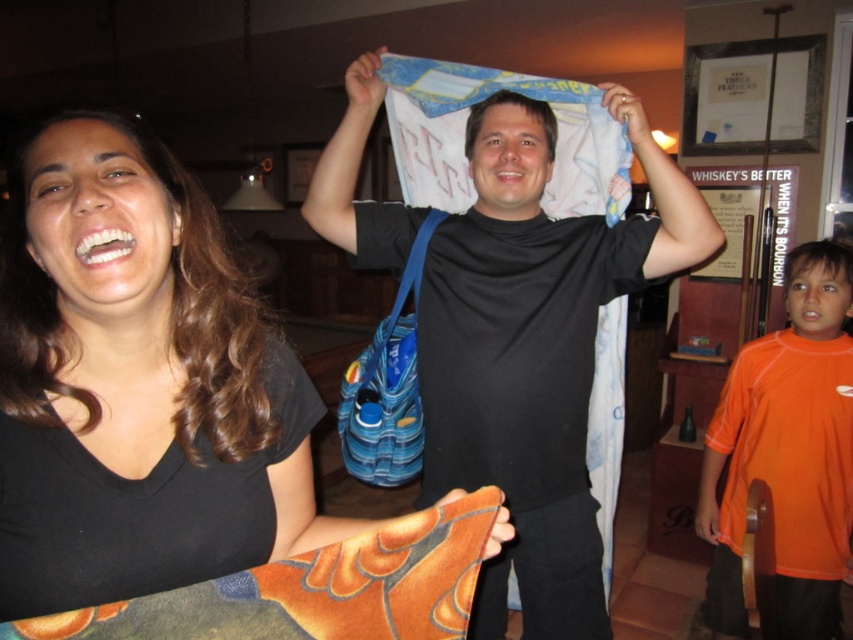
Question: Which object is positioned closest to the matte black shirt at left?

Choices:
 (A) orange jersey at right
 (B) white fabric at center

Answer: (B)

Question: Which object is the closest to the orange jersey at right?

Choices:
 (A) matte black shirt at left
 (B) white fabric at center

Answer: (B)

Question: Can you confirm if matte black shirt at left is smaller than white fabric at center?

Choices:
 (A) no
 (B) yes

Answer: (B)

Question: Can you confirm if matte black shirt at left is smaller than white fabric at center?

Choices:
 (A) yes
 (B) no

Answer: (A)

Question: Can you confirm if matte black shirt at left is smaller than orange jersey at right?

Choices:
 (A) yes
 (B) no

Answer: (A)

Question: Which of the following is the farthest from the observer?

Choices:
 (A) orange jersey at right
 (B) white fabric at center

Answer: (A)